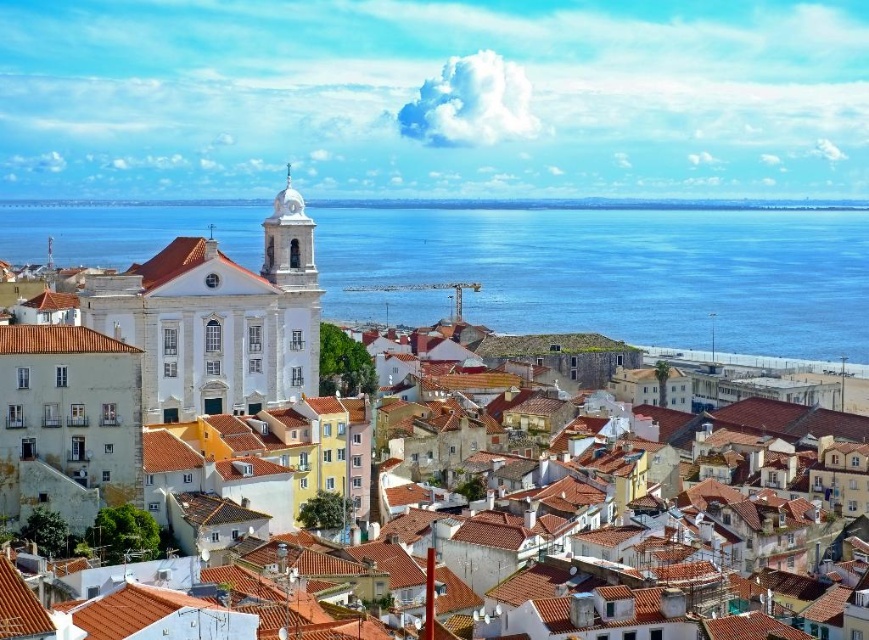
Question: Can you confirm if blue water at center is positioned to the left of white smooth church at upper center?

Choices:
 (A) no
 (B) yes

Answer: (B)

Question: Among these points, which one is farthest from the camera?

Choices:
 (A) (473, 216)
 (B) (423, 266)

Answer: (A)

Question: Which object is closer to the camera taking this photo?

Choices:
 (A) white smooth church at upper center
 (B) blue water at center

Answer: (B)

Question: Is blue water at center positioned before white smooth church at upper center?

Choices:
 (A) no
 (B) yes

Answer: (B)

Question: From the image, what is the correct spatial relationship of blue water at center in relation to white smooth church at upper center?

Choices:
 (A) above
 (B) below

Answer: (B)